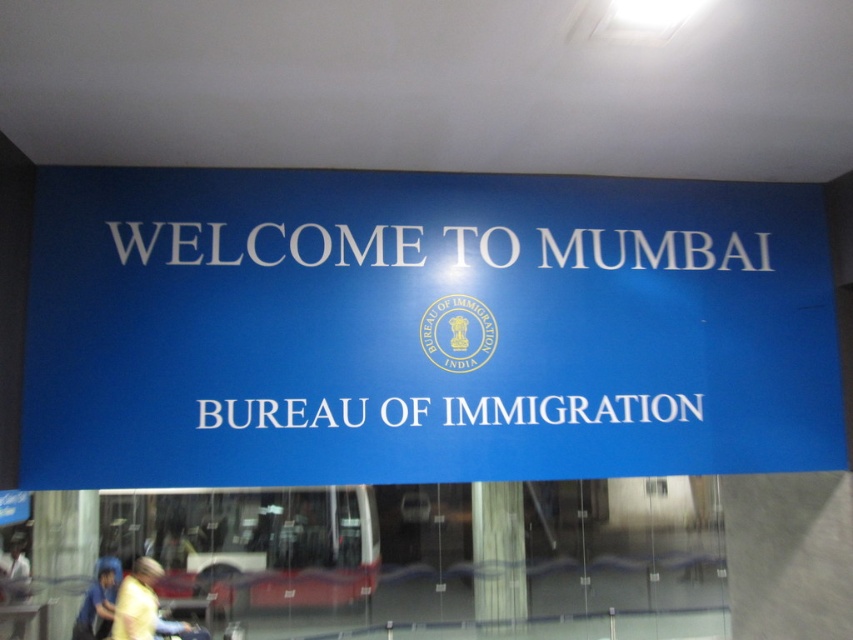
Question: Among these objects, which one is farthest from the camera?

Choices:
 (A) yellow fabric shirt at lower left
 (B) white glossy pillar at center

Answer: (B)

Question: Which of the following is the farthest from the observer?

Choices:
 (A) blue fabric at lower left
 (B) white matte text at upper center

Answer: (A)

Question: Is white plastic text at center smaller than yellow fabric shirt at lower left?

Choices:
 (A) yes
 (B) no

Answer: (A)

Question: Where is blue matte signboard at center located in relation to white matte text at upper center in the image?

Choices:
 (A) left
 (B) right

Answer: (B)

Question: Which object appears farthest from the camera in this image?

Choices:
 (A) white glossy pillar at center
 (B) blue matte signboard at center

Answer: (A)

Question: Is white matte text at upper center smaller than blue fabric at lower left?

Choices:
 (A) no
 (B) yes

Answer: (B)